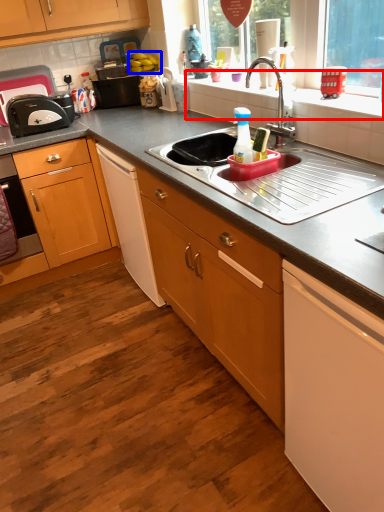
Question: Which point is closer to the camera, window sill (highlighted by a red box) or fruit (highlighted by a blue box)?

Choices:
 (A) window sill
 (B) fruit

Answer: (A)